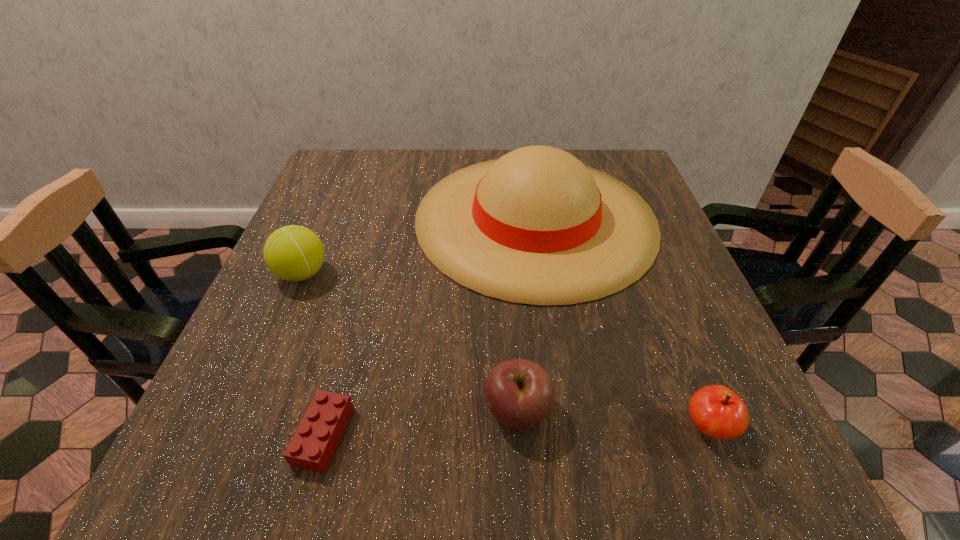
You are a GUI agent. You are given a task and a screenshot of the screen. Output one action in this format:
    pyautogui.click(x=<x>, y=<y>)
    Task: Click on the object present at the near left corner
    
    Given the screenshot: What is the action you would take?
    pyautogui.click(x=311, y=448)

This screenshot has height=540, width=960. What are the coordinates of `object present at the far right corner` in the screenshot? It's located at (536, 226).

The image size is (960, 540). I want to click on object situated at the near right corner, so click(x=718, y=412).

Where is `vacant space at the far edge of the desktop`? The image size is (960, 540). vacant space at the far edge of the desktop is located at coordinates (396, 193).

Where is `vacant space at the near edge`? Image resolution: width=960 pixels, height=540 pixels. vacant space at the near edge is located at coordinates (475, 465).

Where is `vacant position at the left edge of the desktop`? vacant position at the left edge of the desktop is located at coordinates 288,381.

Where is `free spot at the right edge of the desktop`? The height and width of the screenshot is (540, 960). free spot at the right edge of the desktop is located at coordinates (651, 379).

Where is `vacant space at the far right corner of the desktop`? vacant space at the far right corner of the desktop is located at coordinates (635, 183).

Identify the location of free area in between the tallest object and the leftmost object. This screenshot has width=960, height=540. (419, 246).

Image resolution: width=960 pixels, height=540 pixels. Identify the location of free space between the shortest object and the right apple. (516, 431).